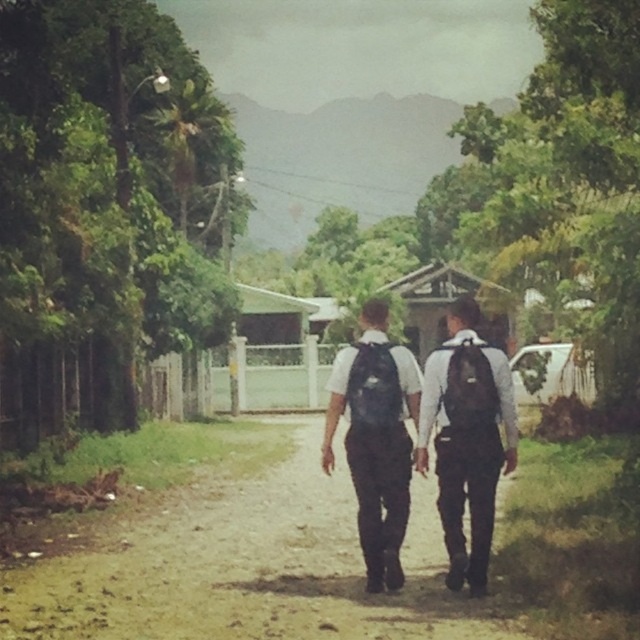
You are a hiker trying to follow the path. From your current position, which object is closer to you, the brown dirt track at center or the black matte backpacks at center?

The brown dirt track at center is closer to you because it is in front of the black matte backpacks at center.

You are a photographer trying to capture the two points in the scene. Which point, point (40, 620) or point (356, 348), will appear larger in your photo?

Point (40, 620) will appear larger in the photo because it is closer to the camera than point (356, 348).